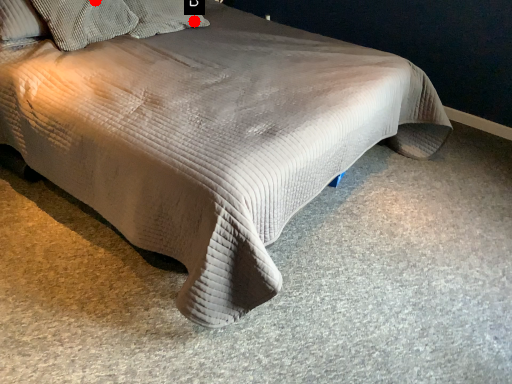
Question: Two points are circled on the image, labeled by A and B beside each circle. Which point is further to the camera?

Choices:
 (A) A is further
 (B) B is further

Answer: (B)